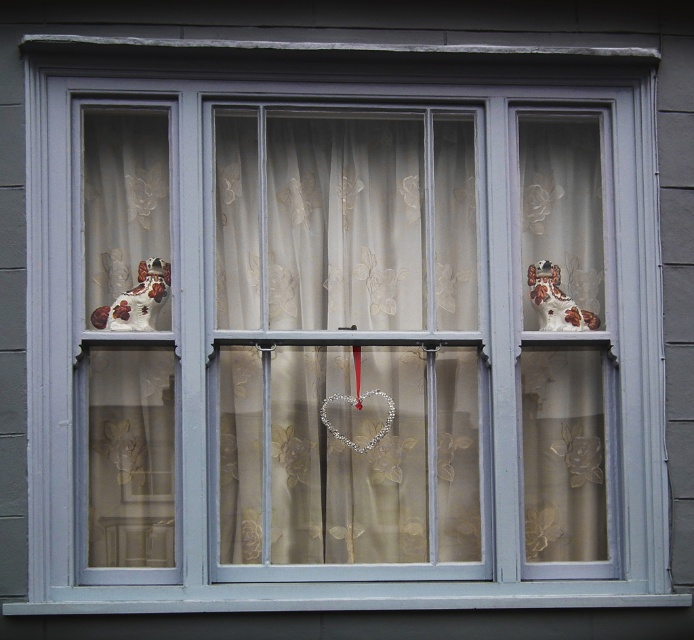
Question: Which of the following is the farthest from the observer?

Choices:
 (A) (559, 596)
 (B) (278, 145)
 (C) (561, 310)

Answer: (B)

Question: Is sheer floral at center bigger than smooth concrete window sill at bottom?

Choices:
 (A) no
 (B) yes

Answer: (B)

Question: Is smooth concrete window sill at bottom in front of porcelain dog at upper right?

Choices:
 (A) no
 (B) yes

Answer: (B)

Question: Considering the relative positions of sheer floral at center and porcelain dog at upper right in the image provided, where is sheer floral at center located with respect to porcelain dog at upper right?

Choices:
 (A) left
 (B) right

Answer: (A)

Question: Which object is positioned closest to the smooth concrete window sill at bottom?

Choices:
 (A) sheer floral at center
 (B) porcelain dog at upper right

Answer: (A)

Question: Which object is farther from the camera taking this photo?

Choices:
 (A) sheer floral at center
 (B) smooth concrete window sill at bottom
 (C) porcelain dog at upper right

Answer: (C)